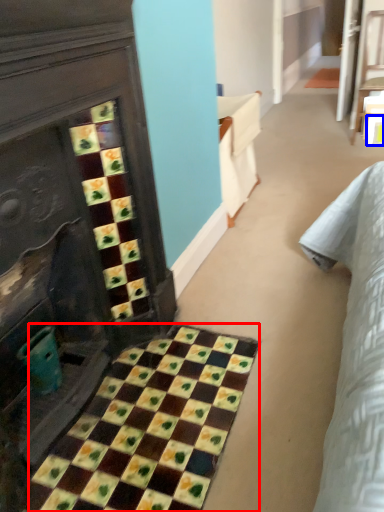
Question: Which object is closer to the camera taking this photo, ceramic tile (highlighted by a red box) or square (highlighted by a blue box)?

Choices:
 (A) ceramic tile
 (B) square

Answer: (A)